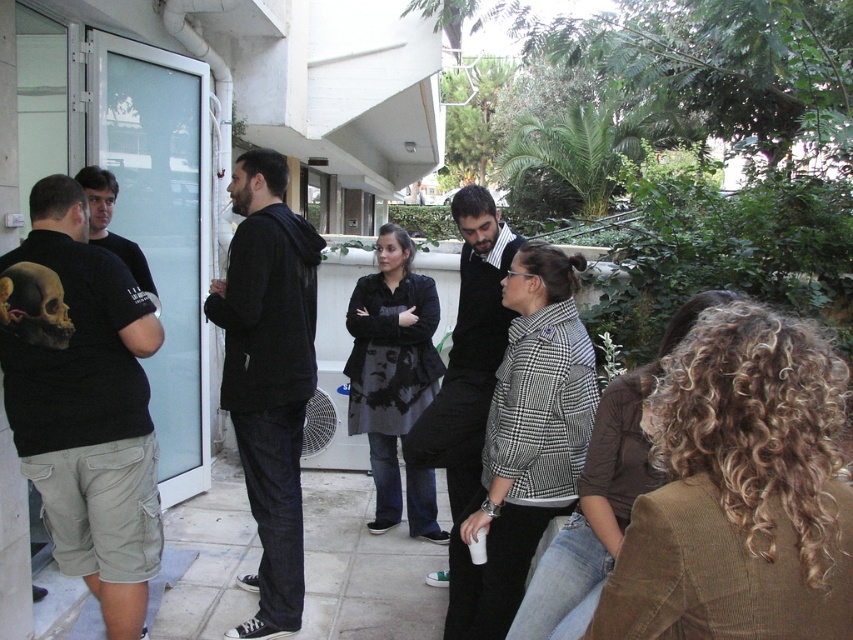
Question: Is black matte t-shirt at left in front of black cotton shirt at center?

Choices:
 (A) no
 (B) yes

Answer: (B)

Question: Observing the image, what is the correct spatial positioning of black cotton hoodie at center in reference to black cotton shirt at center?

Choices:
 (A) right
 (B) left

Answer: (B)

Question: Considering the relative positions of black cotton hoodie at center and matte black hoodie at left in the image provided, where is black cotton hoodie at center located with respect to matte black hoodie at left?

Choices:
 (A) right
 (B) left

Answer: (A)

Question: Which of these objects is positioned farthest from the matte black hoodie at left?

Choices:
 (A) black matte t-shirt at left
 (B) black cotton hoodie at center
 (C) black cotton shirt at center

Answer: (C)

Question: Estimate the real-world distances between objects in this image. Which object is closer to the black cotton hoodie at center?

Choices:
 (A) matte black hoodie at left
 (B) black matte t-shirt at left

Answer: (B)

Question: Among these objects, which one is nearest to the camera?

Choices:
 (A) black matte t-shirt at left
 (B) black cotton shirt at center

Answer: (A)